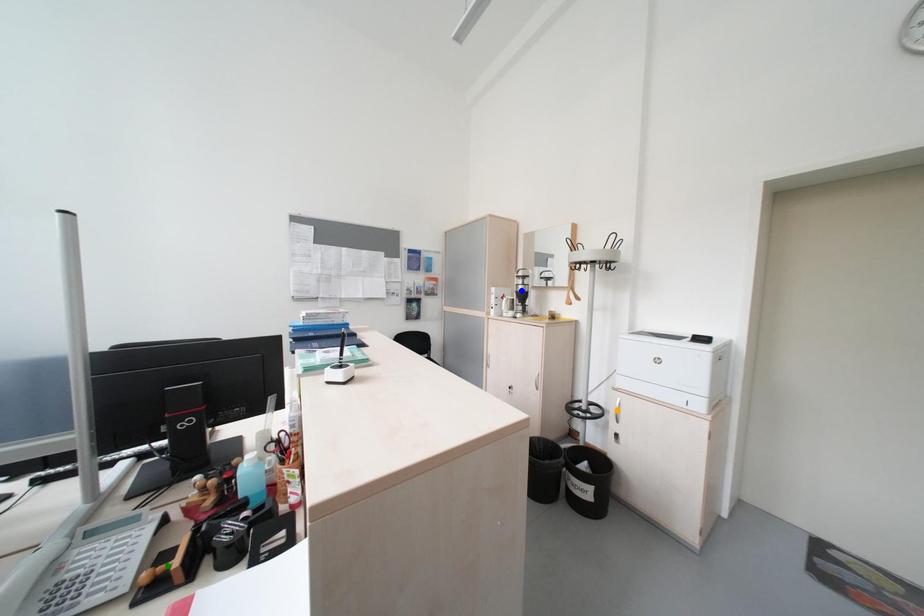
Order these from farthest to nearest:
blue point
orange point
green point

blue point
orange point
green point